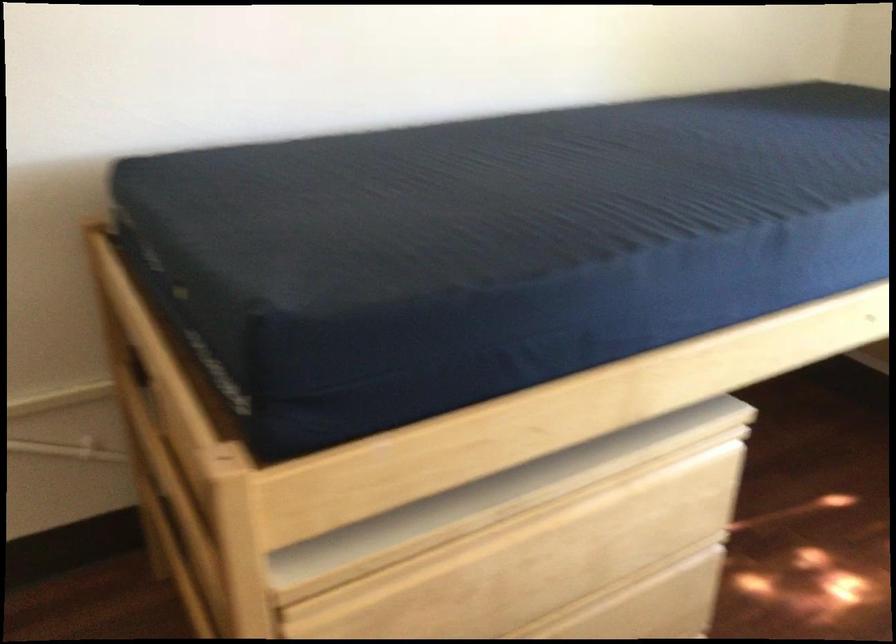
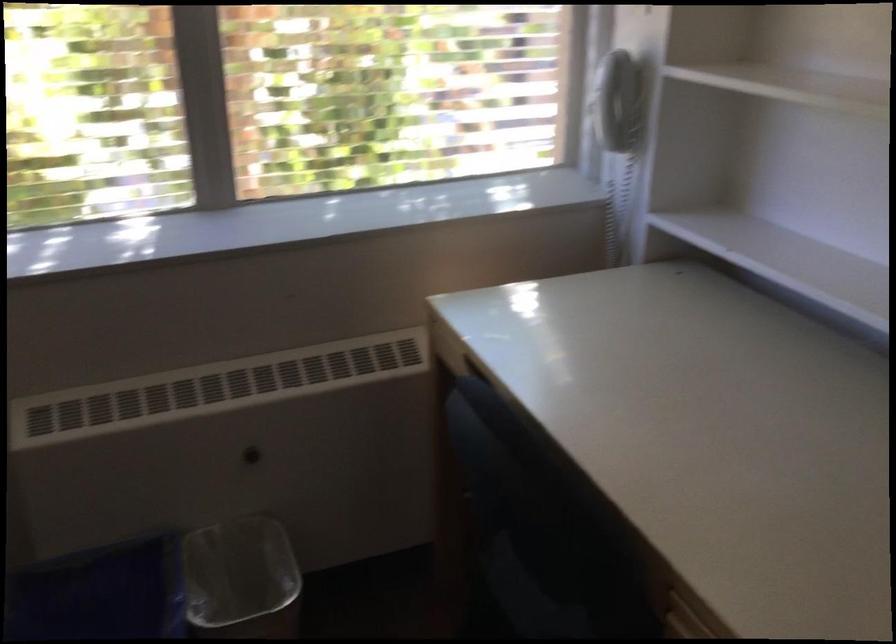
Based on the continuous images, in which direction is the camera rotating?

The rotation direction of the camera is right-down.